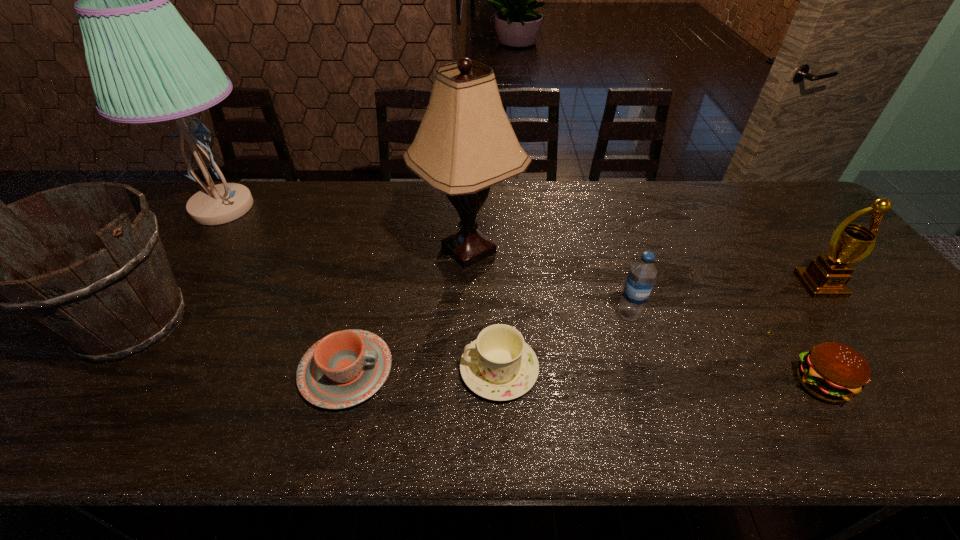
Where is `the left lamp`? This screenshot has width=960, height=540. the left lamp is located at coordinates (146, 65).

Locate an element on the screen. the right lamp is located at coordinates (465, 144).

Identify the location of bucket. The image size is (960, 540). point(117,298).

The height and width of the screenshot is (540, 960). I want to click on award, so click(x=826, y=277).

Find the location of a particular element. the fifth shortest object is located at coordinates (826, 277).

The height and width of the screenshot is (540, 960). I want to click on the fifth tallest object, so click(641, 276).

In order to click on water bottle in this screenshot , I will do `click(641, 276)`.

This screenshot has height=540, width=960. I want to click on hamburger, so click(834, 372).

At what (x,y) coordinates should I click in order to perform the action: click on the taller chinaware. Please return your answer as a coordinate pair (x, y). Looking at the image, I should click on (499, 365).

At what (x,y) coordinates should I click in order to perform the action: click on the shorter chinaware. Please return your answer as a coordinate pair (x, y). The width and height of the screenshot is (960, 540). Looking at the image, I should click on (345, 368).